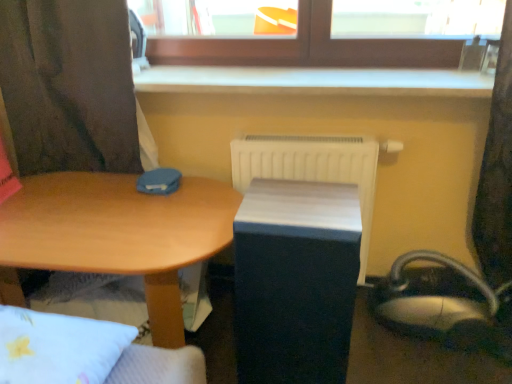
Question: Is there a large distance between matte black changing table at center and wooden desk at center?

Choices:
 (A) no
 (B) yes

Answer: (A)

Question: From the image's perspective, does matte black changing table at center appear higher than wooden desk at center?

Choices:
 (A) yes
 (B) no

Answer: (B)

Question: From a real-world perspective, is matte black changing table at center on top of wooden desk at center?

Choices:
 (A) yes
 (B) no

Answer: (A)

Question: Could you tell me if matte black changing table at center is turned towards wooden desk at center?

Choices:
 (A) yes
 (B) no

Answer: (B)

Question: Does matte black changing table at center have a larger size compared to wooden desk at center?

Choices:
 (A) no
 (B) yes

Answer: (A)

Question: Is white plastic radiator at center wider or thinner than wooden desk at center?

Choices:
 (A) wide
 (B) thin

Answer: (B)

Question: Would you say white plastic radiator at center is to the left or to the right of wooden desk at center in the picture?

Choices:
 (A) left
 (B) right

Answer: (B)

Question: Is point 350,152 closer or farther from the camera than point 179,203?

Choices:
 (A) farther
 (B) closer

Answer: (A)

Question: From the image's perspective, is white plastic radiator at center above or below wooden desk at center?

Choices:
 (A) above
 (B) below

Answer: (A)

Question: In terms of height, does wooden desk at center look taller or shorter compared to white plastic radiator at center?

Choices:
 (A) tall
 (B) short

Answer: (B)

Question: From a real-world perspective, is wooden desk at center physically located above or below white plastic radiator at center?

Choices:
 (A) above
 (B) below

Answer: (B)

Question: Based on their sizes in the image, would you say wooden desk at center is bigger or smaller than white plastic radiator at center?

Choices:
 (A) small
 (B) big

Answer: (B)

Question: Would you say wooden desk at center is to the left or to the right of white plastic radiator at center in the picture?

Choices:
 (A) right
 (B) left

Answer: (B)

Question: Relative to white plastic radiator at center, is matte black changing table at center in front or behind?

Choices:
 (A) behind
 (B) front

Answer: (B)

Question: Considering the positions of matte black changing table at center and white plastic radiator at center in the image, is matte black changing table at center wider or thinner than white plastic radiator at center?

Choices:
 (A) thin
 (B) wide

Answer: (B)